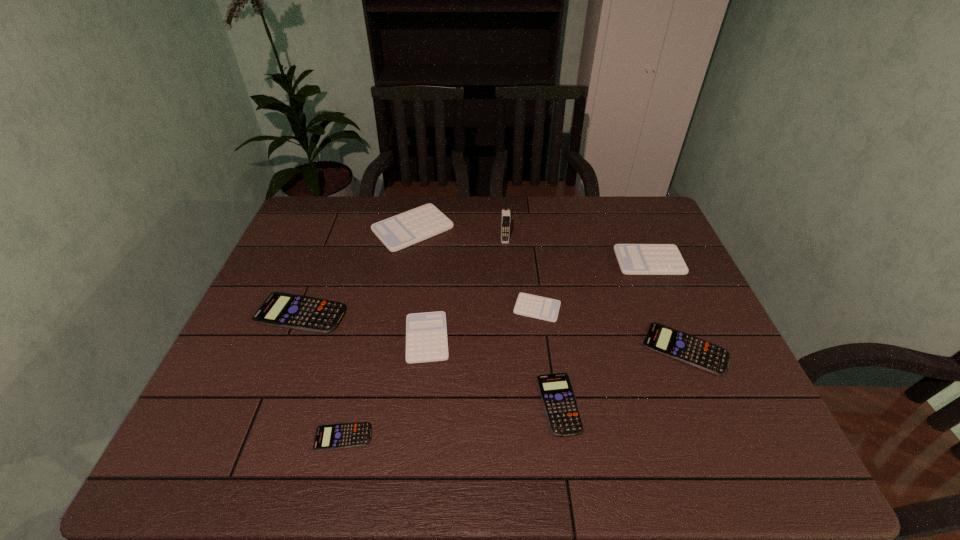
I want to click on vacant space at the far left corner of the desktop, so click(x=299, y=237).

Where is `vacant point at the near left corner`? This screenshot has height=540, width=960. vacant point at the near left corner is located at coordinates (240, 472).

Identify the location of vacant area at the far right corner of the desktop. The height and width of the screenshot is (540, 960). (634, 234).

In order to click on unoccupied position between the tallest object and the second white calculator from right to left in this screenshot , I will do `click(521, 274)`.

Find the location of a particular element. The image size is (960, 540). vacant space in between the leftmost calculator and the smallest white calculator is located at coordinates (419, 310).

Find the location of a particular element. The image size is (960, 540). free space between the biggest white calculator and the third tallest object is located at coordinates (531, 245).

The image size is (960, 540). What are the coordinates of `free space between the tallest calculator and the smallest white calculator` in the screenshot? It's located at (475, 268).

Image resolution: width=960 pixels, height=540 pixels. I want to click on empty space between the seventh tallest calculator and the rightmost blue calculator, so click(x=622, y=376).

Where is `vacant point located between the third smallest blue calculator and the second smallest white calculator`? This screenshot has height=540, width=960. vacant point located between the third smallest blue calculator and the second smallest white calculator is located at coordinates (556, 343).

Locate an element on the screen. This screenshot has width=960, height=540. blank region between the second tallest object and the third blue calculator from left to right is located at coordinates (486, 316).